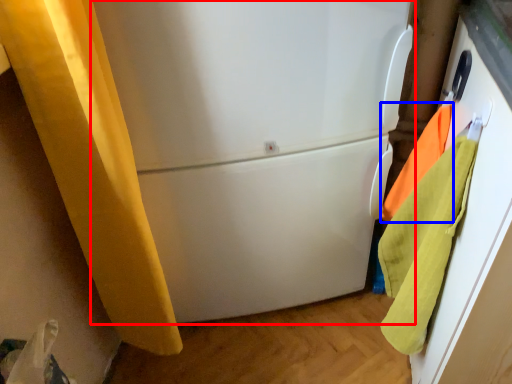
Question: Which object is further to the camera taking this photo, refrigerator (highlighted by a red box) or beach towel (highlighted by a blue box)?

Choices:
 (A) refrigerator
 (B) beach towel

Answer: (B)